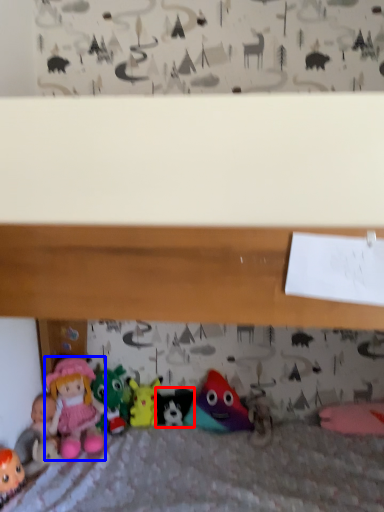
Question: Which point is closer to the camera, toy (highlighted by a red box) or doll (highlighted by a blue box)?

Choices:
 (A) toy
 (B) doll

Answer: (B)